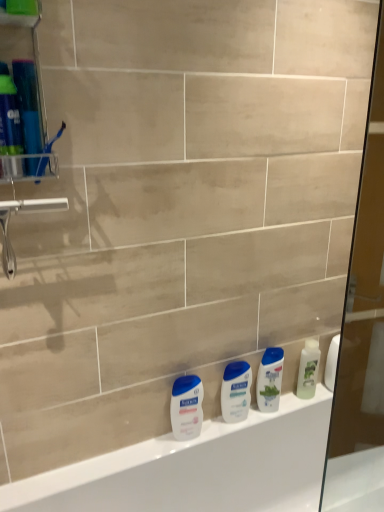
Question: In terms of height, does white glossy lotion at center, the 2th toiletry in the left-to-right sequence, look taller or shorter compared to white glossy lotion at lower center, which is counted as the 1th toiletry, starting from the left?

Choices:
 (A) tall
 (B) short

Answer: (B)

Question: From a real-world perspective, relative to white glossy lotion at lower center, which is counted as the 1th toiletry, starting from the left, is white glossy lotion at center, acting as the first toiletry starting from the right, vertically above or below?

Choices:
 (A) below
 (B) above

Answer: (B)

Question: Estimate the real-world distances between objects in this image. Which object is farther from the clear plastic toothbrush holder at left?

Choices:
 (A) white glossy lotion at lower center, which is counted as the 1th toiletry, starting from the left
 (B) white glossy shampoo at center, which is the second cleaning product in right-to-left order
 (C) white glossy lotion at center, acting as the first toiletry starting from the right
 (D) green matte lotion at right, positioned as the 1th cleaning product in right-to-left order
 (E) white glossy bathtub at lower center

Answer: (D)

Question: Considering the real-world distances, which object is closest to the clear plastic toothbrush holder at left?

Choices:
 (A) white glossy shampoo at center, acting as the 1th cleaning product starting from the left
 (B) white glossy bathtub at lower center
 (C) green matte lotion at right, positioned as the 1th cleaning product in right-to-left order
 (D) white glossy lotion at lower center, positioned as the 2th toiletry in right-to-left order
 (E) white glossy lotion at center, the 2th toiletry in the left-to-right sequence

Answer: (D)